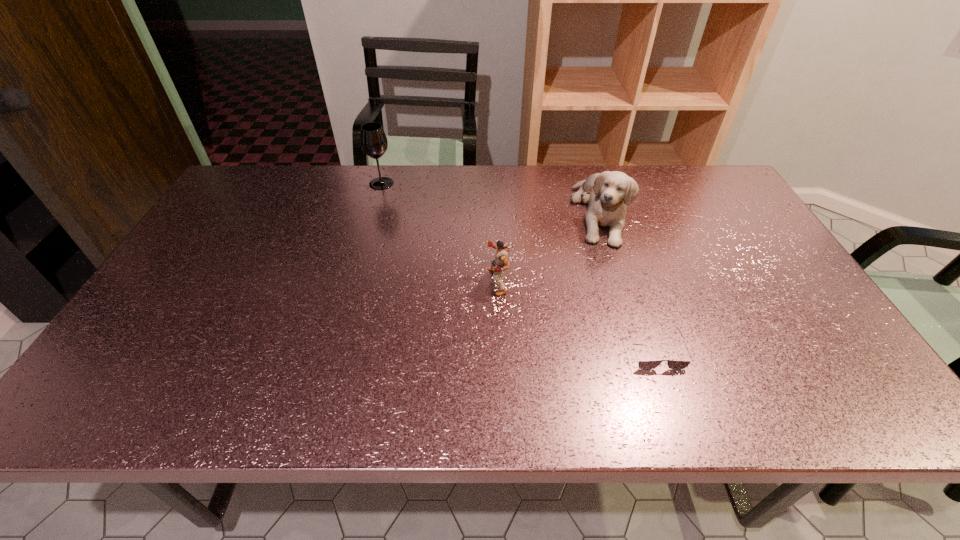
You are a GUI agent. You are given a task and a screenshot of the screen. Output one action in this format:
    pyautogui.click(x=<x>, y=<y>)
    Task: Click on the wineglass
    The image size is (960, 540).
    Given the screenshot: What is the action you would take?
    pyautogui.click(x=373, y=140)

Find the location of a particular element. The height and width of the screenshot is (540, 960). the third shortest object is located at coordinates (609, 192).

The width and height of the screenshot is (960, 540). I want to click on the third farthest object, so point(500,263).

Where is `puncher`? Image resolution: width=960 pixels, height=540 pixels. puncher is located at coordinates (500, 263).

Identify the location of the nearest object. The width and height of the screenshot is (960, 540). 672,364.

Where is `sunglasses`? This screenshot has height=540, width=960. sunglasses is located at coordinates (672, 364).

Identify the location of vacant position located on the front of the leftmost object. (358, 267).

Locate an element on the screen. free location located 0.150m on the front-facing side of the puppy is located at coordinates (623, 288).

You are a GUI agent. You are given a task and a screenshot of the screen. Output one action in this format:
    pyautogui.click(x=<x>, y=<y>)
    Task: Click on the free point located on the front-facing side of the third tallest object
    
    Given the screenshot: What is the action you would take?
    pyautogui.click(x=373, y=281)

At what (x,y) coordinates should I click in order to perform the action: click on vacant space located on the front-facing side of the third tallest object. Please return your answer as a coordinate pair (x, y). The width and height of the screenshot is (960, 540). Looking at the image, I should click on pyautogui.click(x=396, y=281).